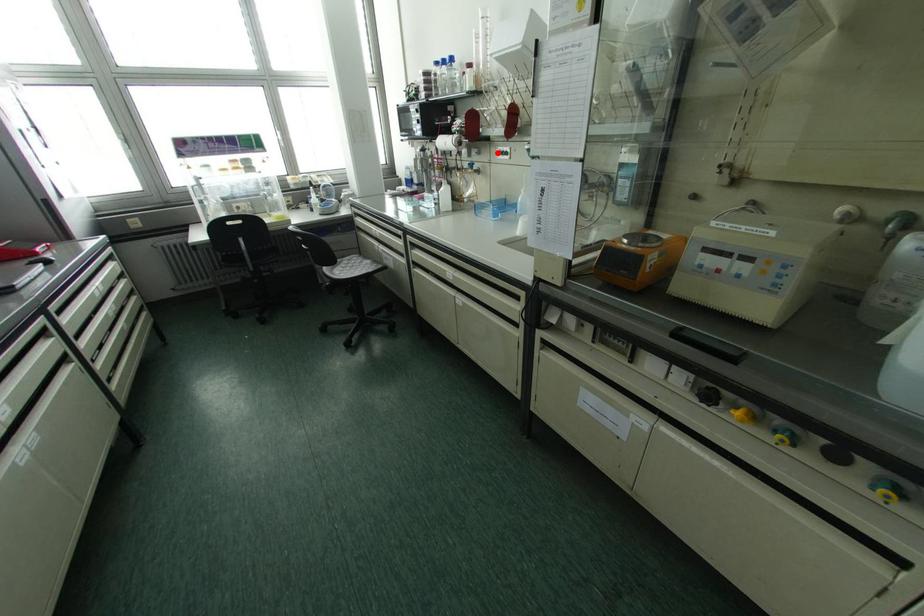
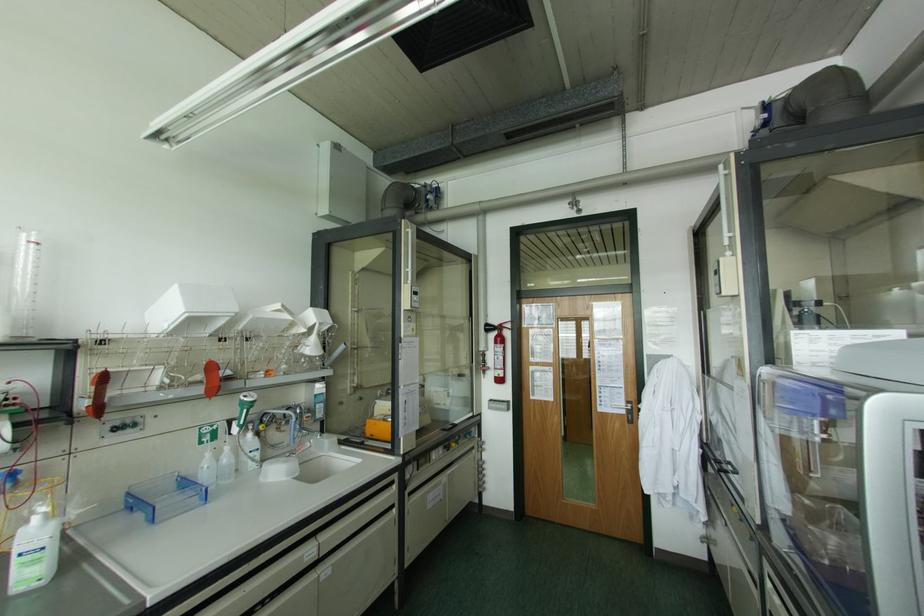
In the second image, find the point that corresponds to the highlighted location in the first image.

(115, 428)